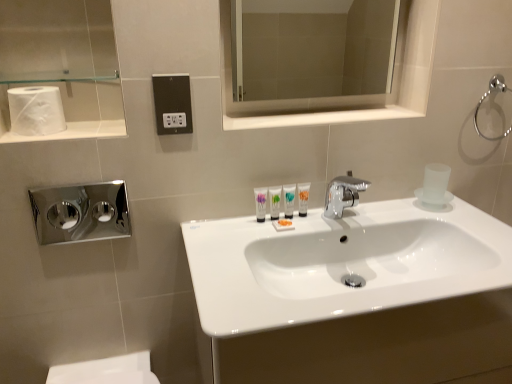
The height and width of the screenshot is (384, 512). Find the location of `free space in front of matte white tube at center, the second mouthwash in the right-to-left sequence`. free space in front of matte white tube at center, the second mouthwash in the right-to-left sequence is located at coordinates (238, 245).